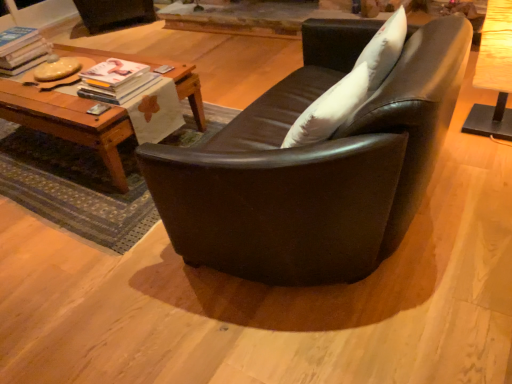
Question: Does matte black couch at center have a greater width compared to matte white magazine at center left, acting as the 1th magazine starting from the right?

Choices:
 (A) no
 (B) yes

Answer: (B)

Question: Can you confirm if matte black couch at center is thinner than matte white magazine at center left, which ranks as the first magazine in front-to-back order?

Choices:
 (A) yes
 (B) no

Answer: (B)

Question: Can matte white magazine at center left, the 1th magazine positioned from the bottom, be found inside matte black couch at center?

Choices:
 (A) no
 (B) yes

Answer: (A)

Question: Is matte black couch at center far away from matte white magazine at center left, the second magazine from the back?

Choices:
 (A) yes
 (B) no

Answer: (B)

Question: From the image's perspective, is matte black couch at center above matte white magazine at center left, which ranks as the first magazine in front-to-back order?

Choices:
 (A) no
 (B) yes

Answer: (A)

Question: From a real-world perspective, is matte black couch at center below matte white magazine at center left, which ranks as the first magazine in front-to-back order?

Choices:
 (A) no
 (B) yes

Answer: (B)

Question: Is matte black couch at center touching white soft pillow at upper right?

Choices:
 (A) yes
 (B) no

Answer: (B)

Question: From the image's perspective, would you say matte black couch at center is shown under white soft pillow at upper right?

Choices:
 (A) yes
 (B) no

Answer: (A)

Question: Is matte black couch at center far away from white soft pillow at upper right?

Choices:
 (A) no
 (B) yes

Answer: (A)

Question: Is matte black couch at center wider than white soft pillow at upper right?

Choices:
 (A) no
 (B) yes

Answer: (B)

Question: Can you confirm if matte black couch at center is smaller than white soft pillow at upper right?

Choices:
 (A) no
 (B) yes

Answer: (A)

Question: Can you confirm if matte black couch at center is positioned to the left of white soft pillow at upper right?

Choices:
 (A) no
 (B) yes

Answer: (B)

Question: Is matte white magazine at center left, the second magazine from the back, a part of woodenwoodentable at left, which is the 1th table in left-to-right order?

Choices:
 (A) yes
 (B) no

Answer: (B)